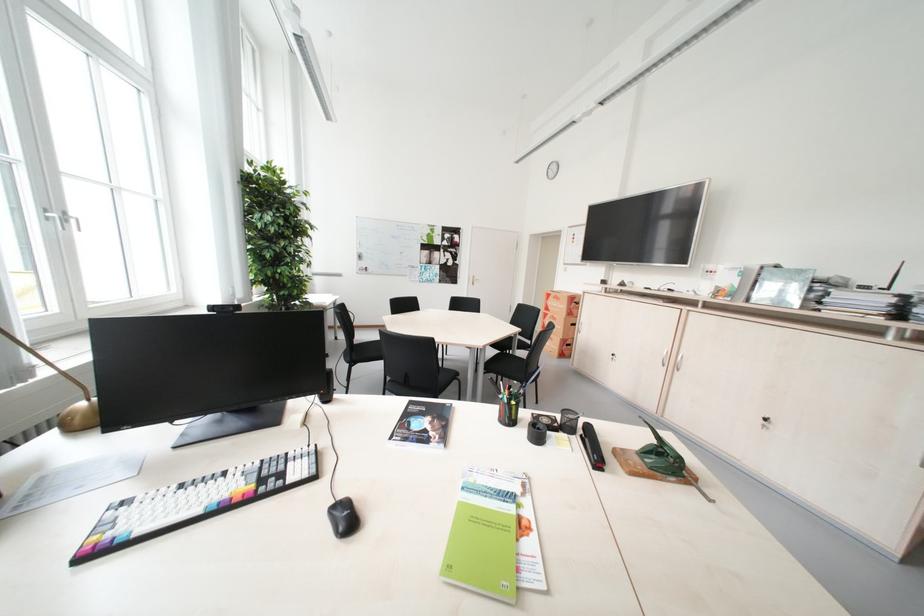
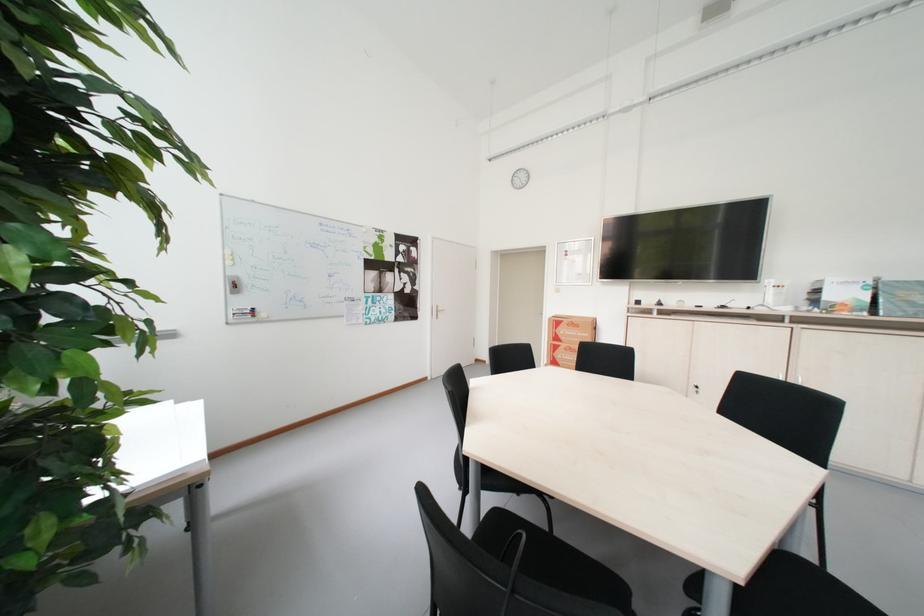
Question: I am providing you with two images of the same scene from different viewpoints. Please identify which objects are invisible in image2.

Choices:
 (A) red whiteboard marker
 (B) black chair sitting surface
 (C) recessed cabinet handle
 (D) black seatbelt buckle

Answer: (B)